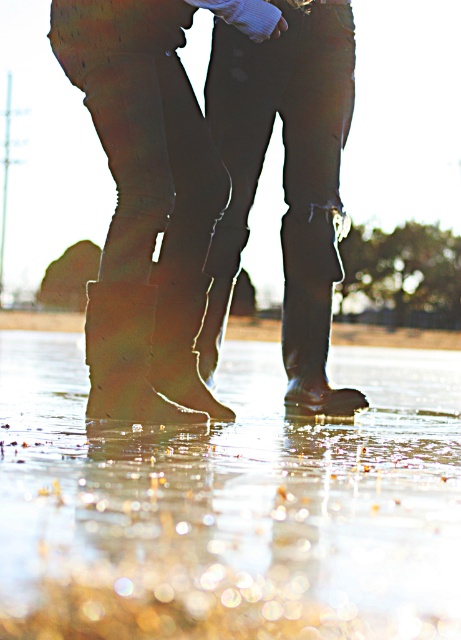
Question: Is clear water at lower center closer to the viewer compared to leather boots at center?

Choices:
 (A) yes
 (B) no

Answer: (B)

Question: Is clear water at lower center bigger than leather boots at center?

Choices:
 (A) yes
 (B) no

Answer: (B)

Question: Does clear water at lower center appear on the left side of leather boots at center?

Choices:
 (A) yes
 (B) no

Answer: (B)

Question: Which of the following is the closest to the observer?

Choices:
 (A) leather boots at center
 (B) clear water at lower center

Answer: (A)